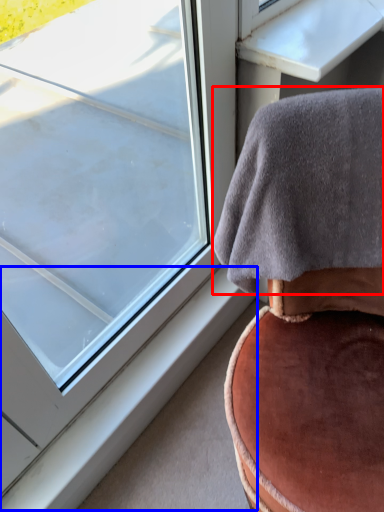
Question: Among these objects, which one is farthest to the camera, blanket (highlighted by a red box) or window sill (highlighted by a blue box)?

Choices:
 (A) blanket
 (B) window sill

Answer: (B)